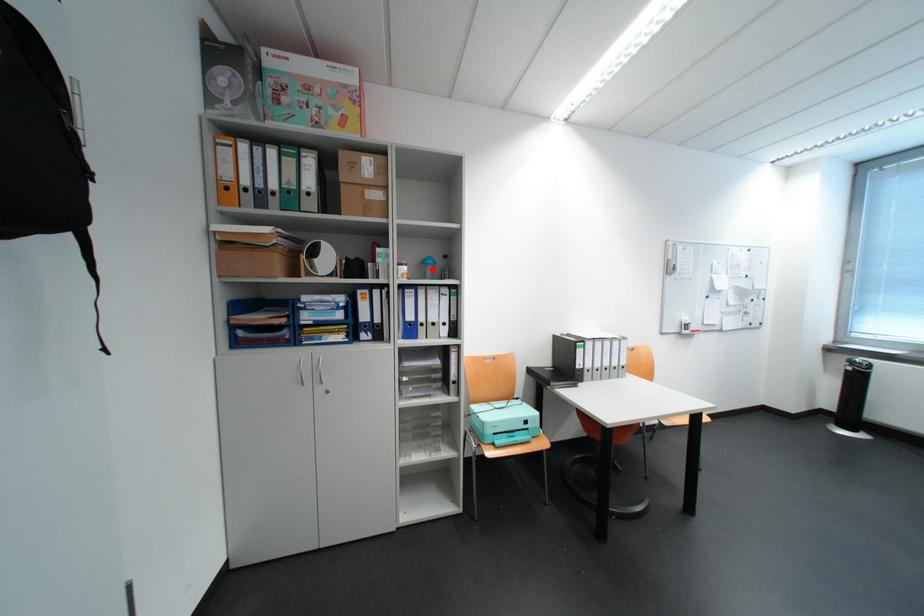
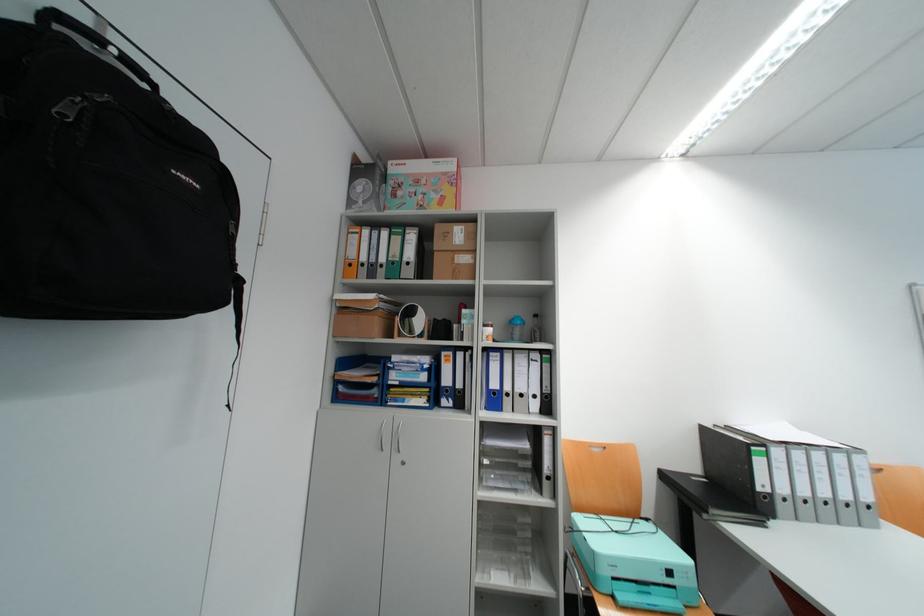
The point at the highlighted location is marked in the first image. Where is the corresponding point in the second image?

(518, 330)